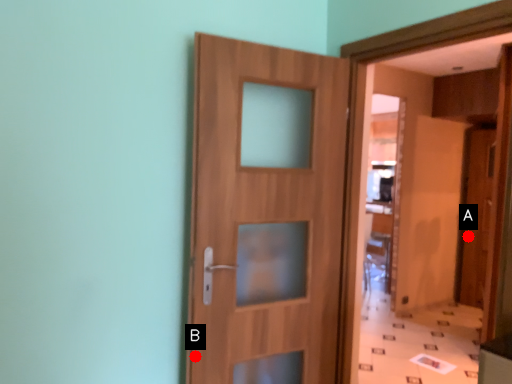
Question: Two points are circled on the image, labeled by A and B beside each circle. Which point is farther to the camera?

Choices:
 (A) A is further
 (B) B is further

Answer: (A)